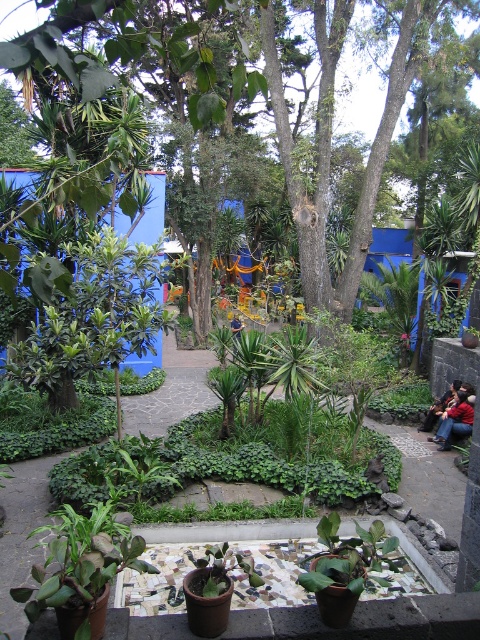
Can you confirm if red leather jacket at lower right is positioned above dark blue jeans at lower right?

Actually, red leather jacket at lower right is below dark blue jeans at lower right.

Between point (447, 433) and point (428, 413), which one is positioned in front?

Point (447, 433)

Locate an element on the screen. The image size is (480, 640). red leather jacket at lower right is located at coordinates (455, 420).